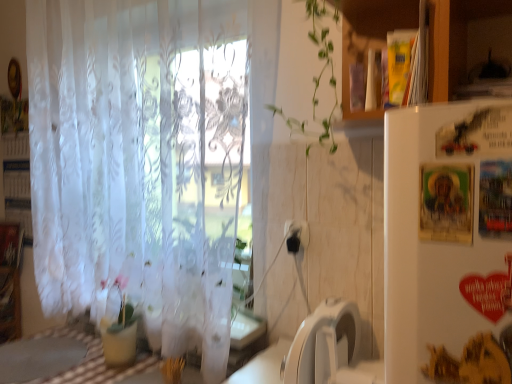
Question: Is black plastic electric outlet at center placed right next to white cardboard bookshelf at left?

Choices:
 (A) no
 (B) yes

Answer: (A)

Question: Is black plastic electric outlet at center located outside white cardboard bookshelf at left?

Choices:
 (A) yes
 (B) no

Answer: (A)

Question: Is black plastic electric outlet at center bigger than white cardboard bookshelf at left?

Choices:
 (A) yes
 (B) no

Answer: (B)

Question: From the image's perspective, is black plastic electric outlet at center on top of white cardboard bookshelf at left?

Choices:
 (A) yes
 (B) no

Answer: (B)

Question: Is black plastic electric outlet at center positioned far away from white cardboard bookshelf at left?

Choices:
 (A) no
 (B) yes

Answer: (B)

Question: Does black plastic electric outlet at center appear on the right side of white cardboard bookshelf at left?

Choices:
 (A) yes
 (B) no

Answer: (A)

Question: Is checkered fabric table at lower left turned away from white cardboard bookshelf at left?

Choices:
 (A) yes
 (B) no

Answer: (B)

Question: Can you confirm if checkered fabric table at lower left is wider than white cardboard bookshelf at left?

Choices:
 (A) yes
 (B) no

Answer: (A)

Question: Is checkered fabric table at lower left thinner than white cardboard bookshelf at left?

Choices:
 (A) no
 (B) yes

Answer: (A)

Question: Is checkered fabric table at lower left in front of white cardboard bookshelf at left?

Choices:
 (A) no
 (B) yes

Answer: (B)

Question: Could white cardboard bookshelf at left be considered to be inside checkered fabric table at lower left?

Choices:
 (A) yes
 (B) no

Answer: (B)

Question: From the image's perspective, is checkered fabric table at lower left on white cardboard bookshelf at left?

Choices:
 (A) yes
 (B) no

Answer: (B)

Question: Is translucent white curtain at left smaller than checkered fabric table at lower left?

Choices:
 (A) no
 (B) yes

Answer: (A)